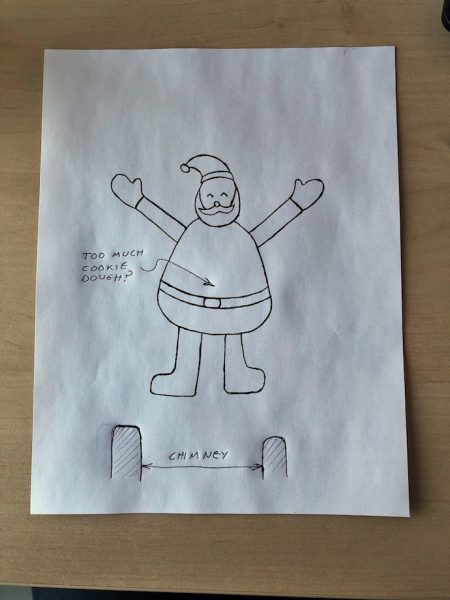
Find the location of a particular element. This screenshot has height=600, width=450. piece of paper is located at coordinates (272, 152).